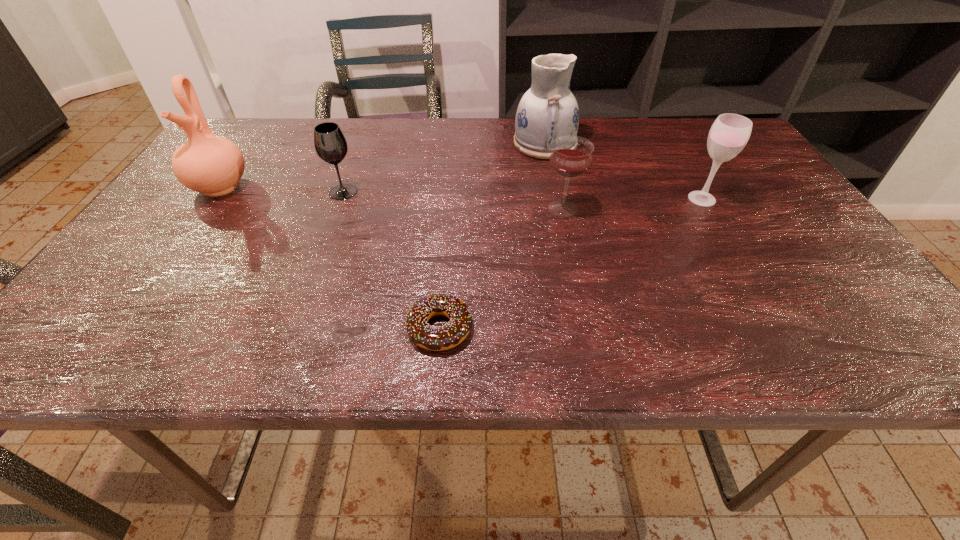
I want to click on vacant area at the left edge, so click(129, 259).

Locate an element on the screen. free region at the right edge of the desktop is located at coordinates (805, 270).

In order to click on vacant space at the far left corner of the desktop in this screenshot , I will do `click(256, 125)`.

You are a GUI agent. You are given a task and a screenshot of the screen. Output one action in this format:
    pyautogui.click(x=<x>, y=<y>)
    Task: Click on the vacant space at the near left corner of the desktop
    This screenshot has height=540, width=960.
    Given the screenshot: What is the action you would take?
    pyautogui.click(x=141, y=338)

Where is `vacant position at the far right corner of the desktop`? vacant position at the far right corner of the desktop is located at coordinates (695, 148).

Find the location of a particular element. vacant space at the near right corner of the desktop is located at coordinates (829, 347).

Locate an element on the screen. The height and width of the screenshot is (540, 960). vacant region between the fifth object from right to left and the second wineglass from left to right is located at coordinates (453, 200).

Image resolution: width=960 pixels, height=540 pixels. Find the location of `vacant area between the rightmost wineglass and the left pottery`. vacant area between the rightmost wineglass and the left pottery is located at coordinates (461, 192).

The height and width of the screenshot is (540, 960). In order to click on free space between the nearest object and the nearer pottery in this screenshot , I will do `click(330, 257)`.

Where is `vacant space that's between the second wineglass from right to left and the leftmost object`? vacant space that's between the second wineglass from right to left and the leftmost object is located at coordinates (392, 197).